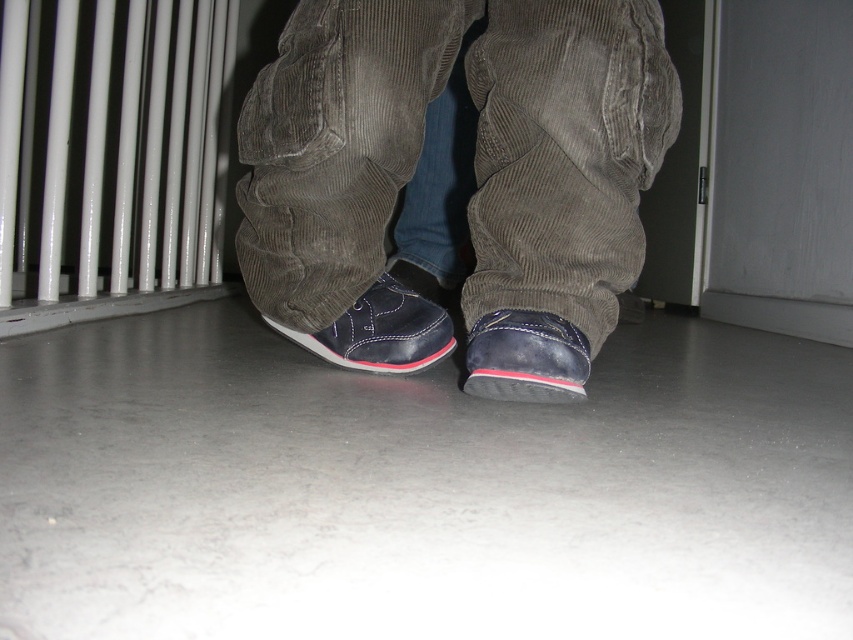
Question: Does white glossy radiator at left have a larger size compared to matte leather shoe at center?

Choices:
 (A) no
 (B) yes

Answer: (B)

Question: Which point is farther to the camera?

Choices:
 (A) (418, 356)
 (B) (564, 387)
 (C) (467, 209)

Answer: (A)

Question: Which object is positioned farthest from the matte corduroy pants at center?

Choices:
 (A) matte leather shoe at center
 (B) matte leather shoe at lower center
 (C) white glossy radiator at left

Answer: (C)

Question: Does matte leather shoe at lower center have a lesser width compared to matte leather shoe at center?

Choices:
 (A) no
 (B) yes

Answer: (B)

Question: Which point appears closest to the camera in this image?

Choices:
 (A) (486, 344)
 (B) (368, 365)
 (C) (28, 10)

Answer: (A)

Question: Does matte corduroy pants at center appear over matte leather shoe at center?

Choices:
 (A) yes
 (B) no

Answer: (A)